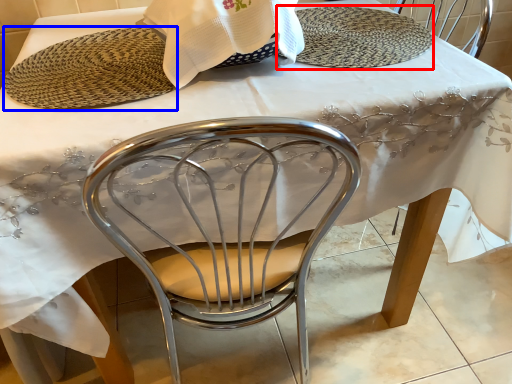
Question: Among these objects, which one is farthest to the camera, plate (highlighted by a red box) or platter (highlighted by a blue box)?

Choices:
 (A) plate
 (B) platter

Answer: (A)